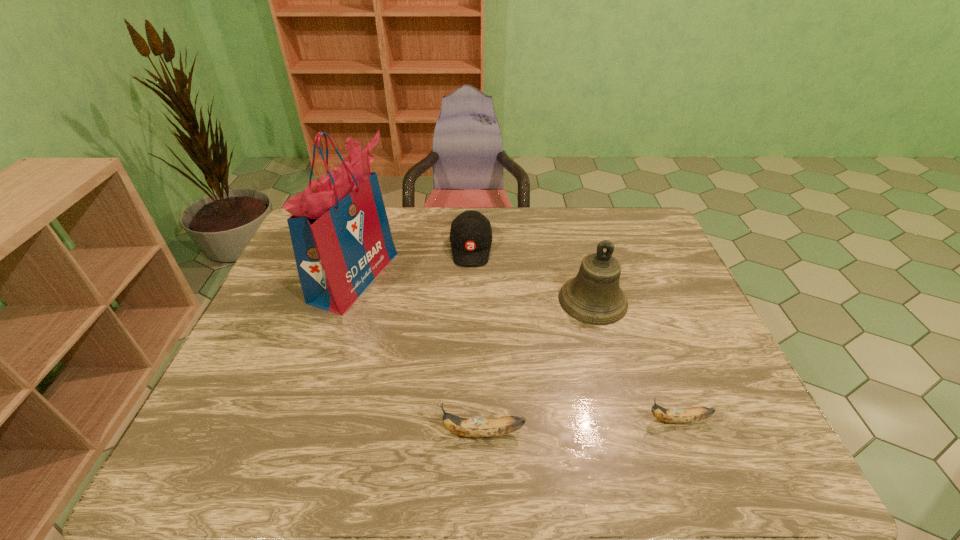
The width and height of the screenshot is (960, 540). Identify the location of object that stands as the third closest to the shorter banana. (471, 234).

Identify the location of free space that satisfies the following two spatial constraints: 1. with a logo on the front of the baseball cap; 2. on the front-facing side of the tallest object. The width and height of the screenshot is (960, 540). (470, 276).

Locate an element on the screen. The width and height of the screenshot is (960, 540). free location that satisfies the following two spatial constraints: 1. on the front-facing side of the grocery bag; 2. on the left side of the second tallest object is located at coordinates (347, 300).